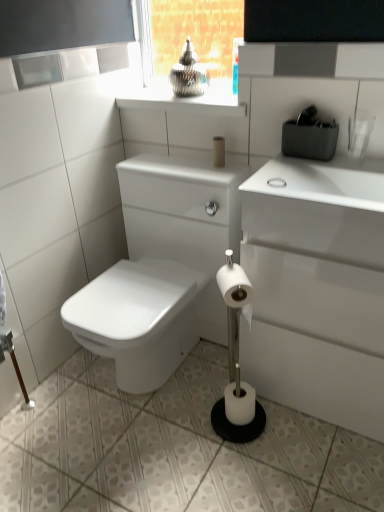
This screenshot has height=512, width=384. I want to click on vacant point above white glossy ceramic tile at lower center (from a real-world perspective), so (180, 436).